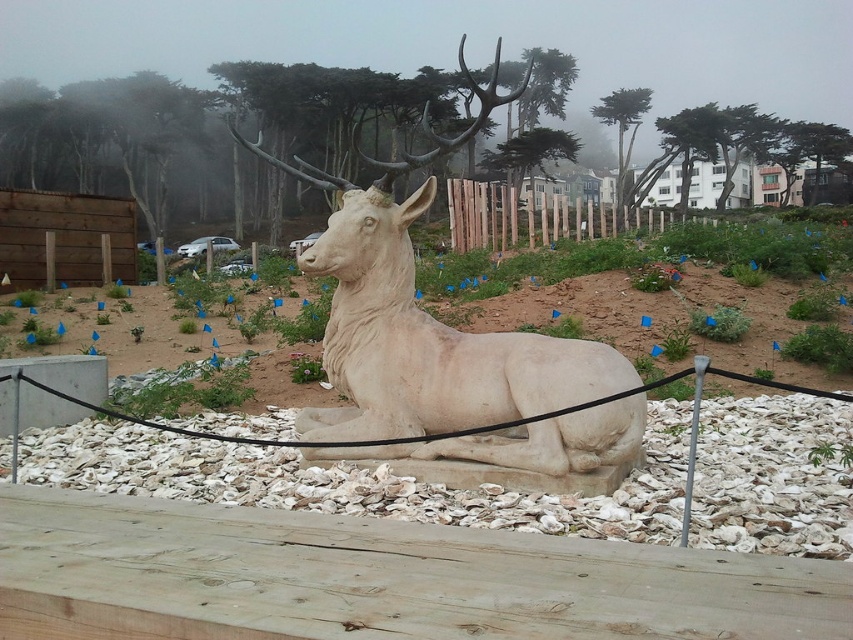
Does white gravel at center have a larger size compared to white stone sculpture at center?

Incorrect, white gravel at center is not larger than white stone sculpture at center.

Is white gravel at center below white stone sculpture at center?

Indeed, white gravel at center is positioned under white stone sculpture at center.

The image size is (853, 640). What are the coordinates of `white gravel at center` in the screenshot? It's located at (354, 481).